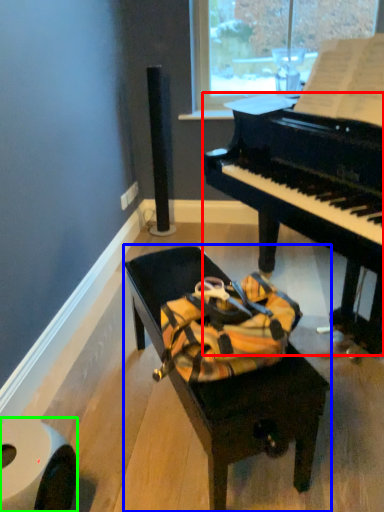
Question: Which object is the closest to the piano (highlighted by a red box)? Choose among these: furniture (highlighted by a blue box) or toilet paper (highlighted by a green box).

Choices:
 (A) furniture
 (B) toilet paper

Answer: (A)